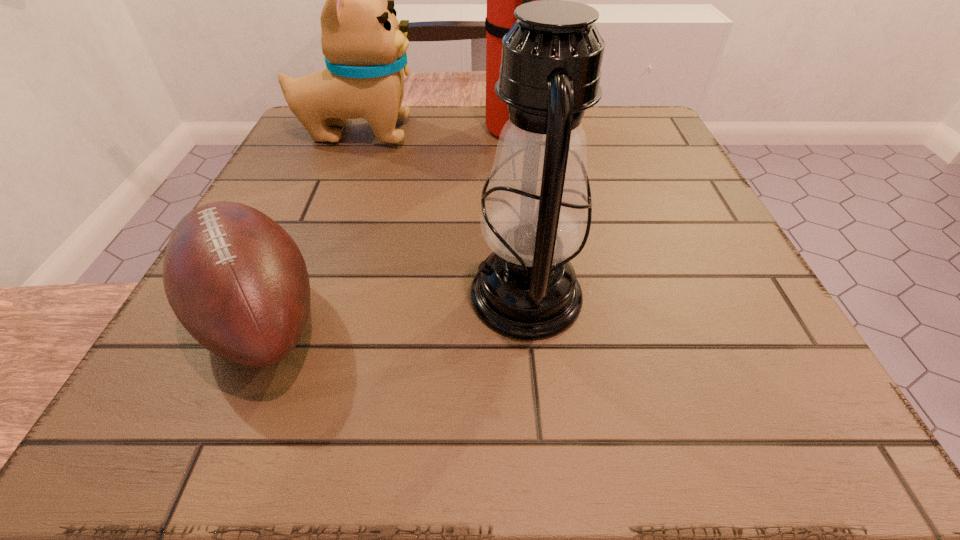
Locate an element on the screen. This screenshot has width=960, height=540. fire extinguisher present at the far edge is located at coordinates (502, 0).

At what (x,y) coordinates should I click in order to perform the action: click on puppy that is at the far edge. Please return your answer as a coordinate pair (x, y). This screenshot has height=540, width=960. Looking at the image, I should click on (364, 45).

The width and height of the screenshot is (960, 540). I want to click on object that is at the near edge, so click(236, 280).

Find the location of a particular element. Image resolution: width=960 pixels, height=540 pixels. puppy located at the left edge is located at coordinates (364, 45).

Locate an element on the screen. The image size is (960, 540). football (American) located in the left edge section of the desktop is located at coordinates (236, 280).

At what (x,y) coordinates should I click in order to perform the action: click on object positioned at the far left corner. Please return your answer as a coordinate pair (x, y). The image size is (960, 540). Looking at the image, I should click on (364, 45).

Identify the location of object that is at the near left corner. The width and height of the screenshot is (960, 540). (236, 280).

Image resolution: width=960 pixels, height=540 pixels. I want to click on free space at the far edge of the desktop, so click(435, 131).

You are a GUI agent. You are given a task and a screenshot of the screen. Output one action in this format:
    pyautogui.click(x=<x>, y=<y>)
    Task: Click on the vacant space at the near edge of the desktop
    
    Given the screenshot: What is the action you would take?
    pyautogui.click(x=274, y=438)

The height and width of the screenshot is (540, 960). In the image, there is a desktop. Identify the location of vacant space at the left edge. (328, 184).